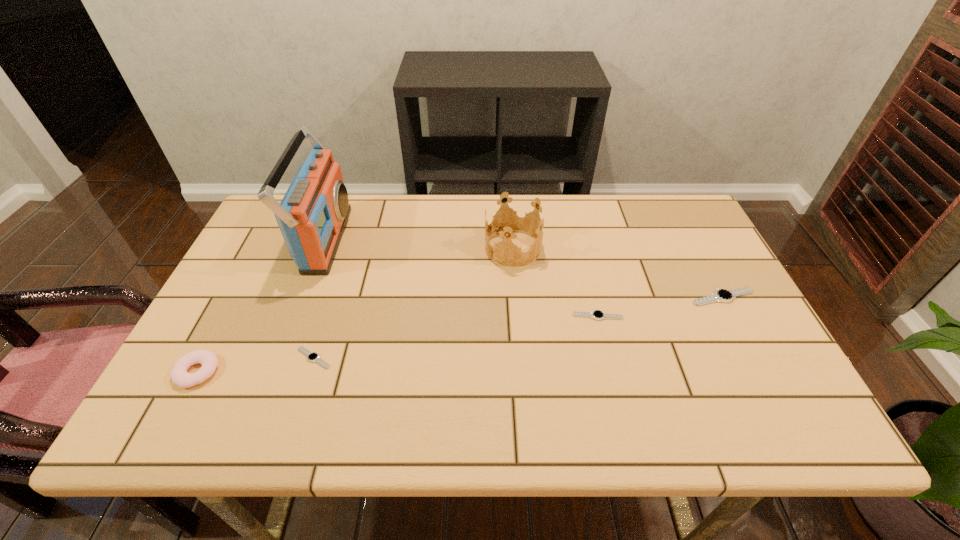
In the image, there is a desktop. Where is `vacant space at the far right corner`? The height and width of the screenshot is (540, 960). vacant space at the far right corner is located at coordinates (655, 201).

You are a GUI agent. You are given a task and a screenshot of the screen. Output one action in this format:
    pyautogui.click(x=<x>, y=<y>)
    Task: Click on the vacant space at the near right corner of the desktop
    
    Given the screenshot: What is the action you would take?
    pyautogui.click(x=769, y=386)

The height and width of the screenshot is (540, 960). Identify the location of free space between the second shortest watch and the radio receiver. (462, 278).

Locate an element on the screen. free space between the third nearest object and the third object from right to left is located at coordinates (555, 282).

Find the location of a particular element. This screenshot has height=540, width=960. vacant area that lies between the fourth object from left to right and the rightmost watch is located at coordinates (618, 272).

Where is `vacant region between the leftmost object and the leftmost watch`? The height and width of the screenshot is (540, 960). vacant region between the leftmost object and the leftmost watch is located at coordinates (255, 364).

The height and width of the screenshot is (540, 960). I want to click on empty space that is in between the fifth shortest object and the doughnut, so click(355, 309).

Where is `empty space between the doughnut and the shortest object`? The height and width of the screenshot is (540, 960). empty space between the doughnut and the shortest object is located at coordinates (255, 364).

Locate an element on the screen. blank region between the fourth object from left to right and the leftmost watch is located at coordinates (413, 303).

Locate an element on the screen. This screenshot has width=960, height=540. vacant space that's between the farthest watch and the second watch from left to right is located at coordinates (660, 306).